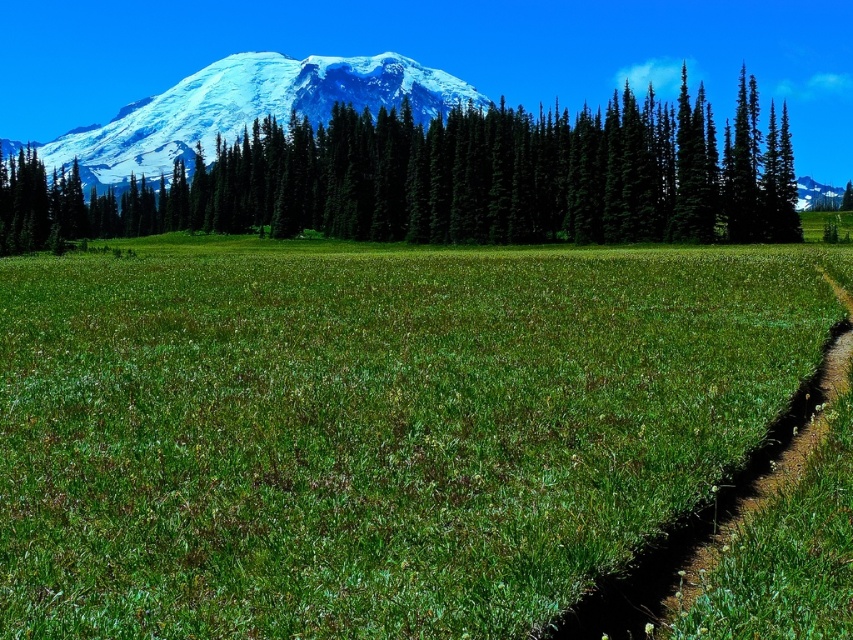
Question: Which point appears farthest from the camera in this image?

Choices:
 (A) (788, 225)
 (B) (761, 596)

Answer: (A)

Question: Is green grassy pasture at center thinner than snowy white mountain at upper left?

Choices:
 (A) no
 (B) yes

Answer: (B)

Question: Estimate the real-world distances between objects in this image. Which object is farther from the green grassy pasture at center?

Choices:
 (A) snowy white mountain at upper left
 (B) green matte trees at upper center
 (C) brown dirt path at lower right

Answer: (A)

Question: Which point is farther to the camera?

Choices:
 (A) (294, 97)
 (B) (668, 616)
 (C) (428, 228)

Answer: (A)

Question: Is the position of green grassy pasture at center more distant than that of brown dirt path at lower right?

Choices:
 (A) no
 (B) yes

Answer: (B)

Question: Can you confirm if green grassy pasture at center is positioned to the right of snowy white mountain at upper left?

Choices:
 (A) no
 (B) yes

Answer: (B)